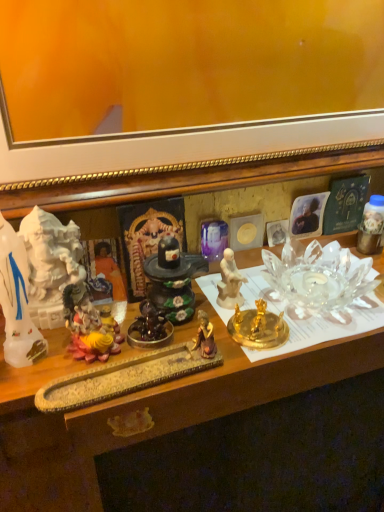
You are a GUI agent. You are given a task and a screenshot of the screen. Output one action in this format:
    pyautogui.click(x=<x>, y=<y>)
    Task: Click on the vacant area that is situated to the right of gold metallic candle holder at center
    
    Given the screenshot: What is the action you would take?
    pyautogui.click(x=334, y=322)